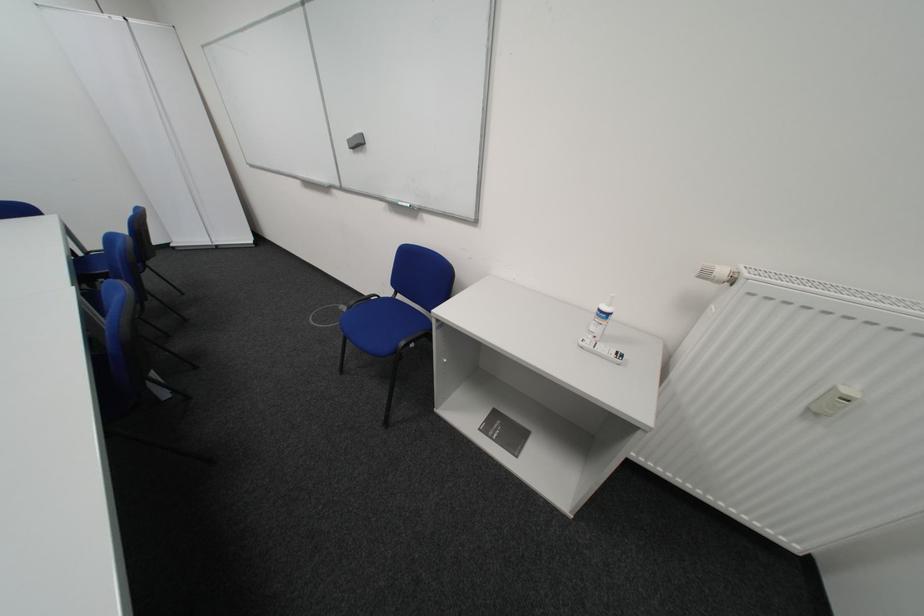
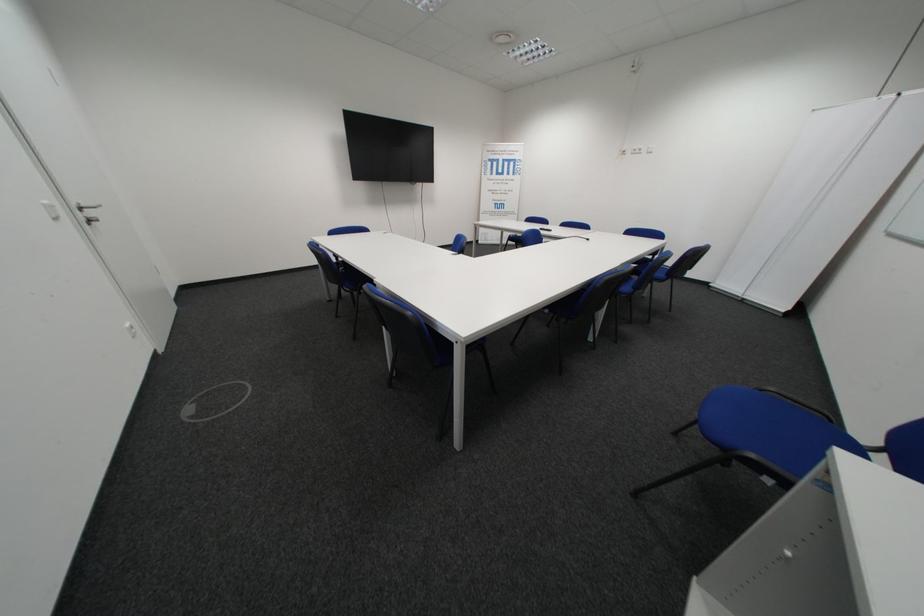
The point at (415, 344) is marked in the first image. Where is the corresponding point in the second image?

(761, 456)